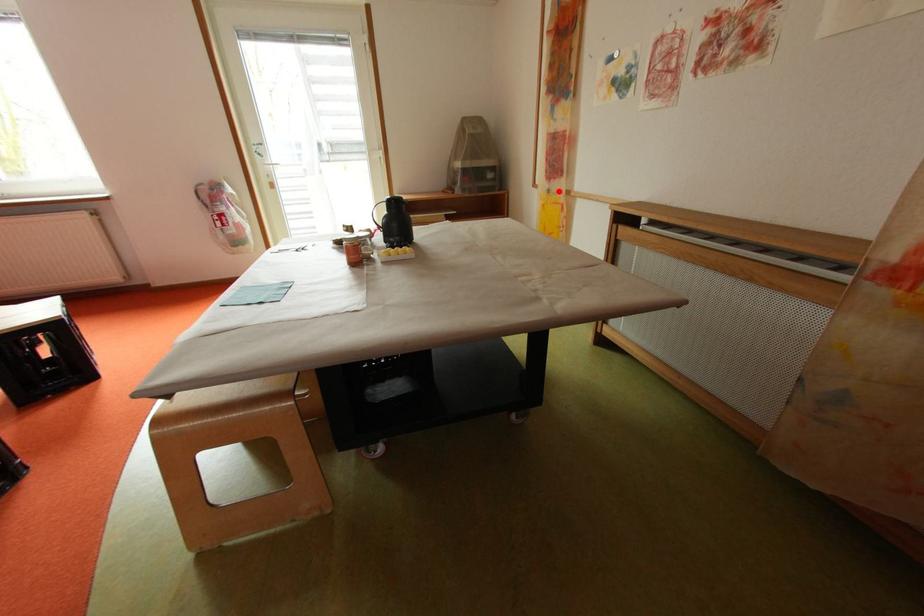
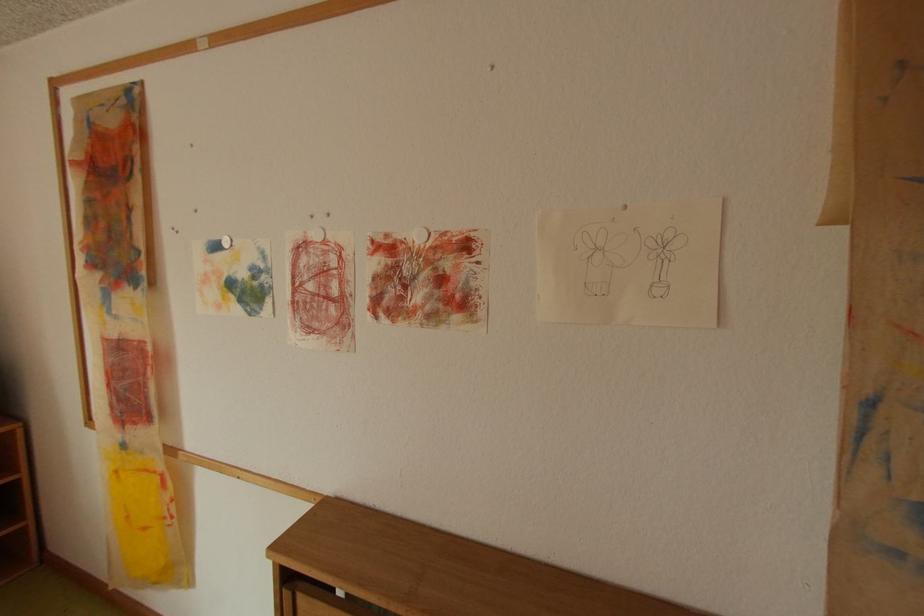
Find the pixel in the second image that matches the highlighted location in the first image.

(134, 446)